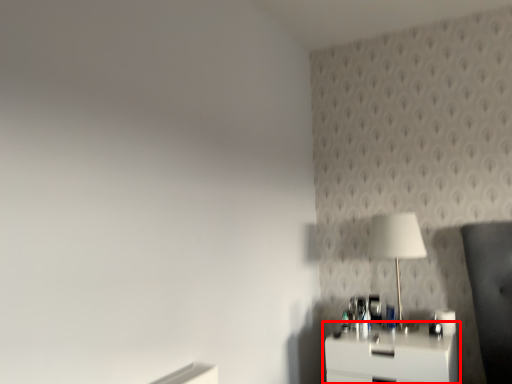
Question: From the image's perspective, what is the correct spatial positioning of nightstand (annotated by the red box) in reference to table lamp?

Choices:
 (A) below
 (B) above

Answer: (A)